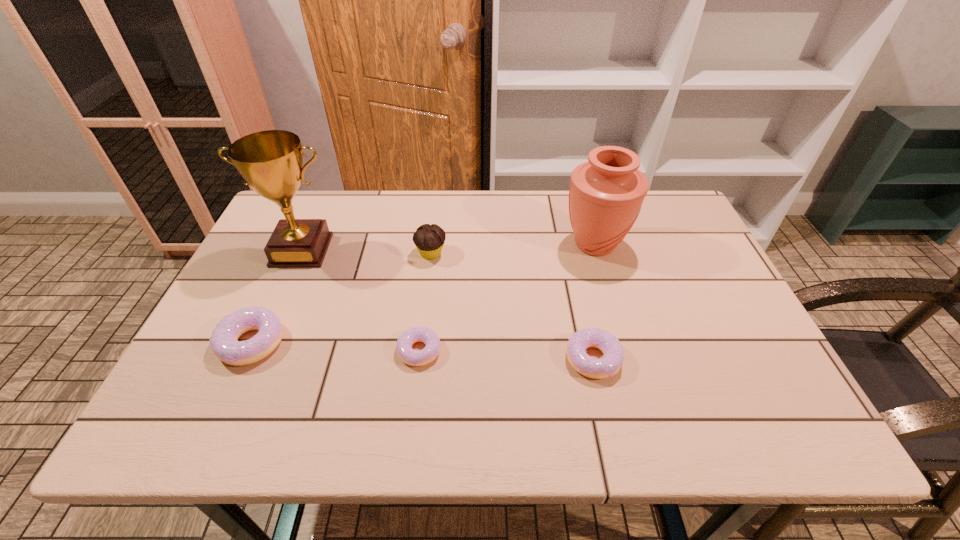
Where is `the third shortest object`? The image size is (960, 540). the third shortest object is located at coordinates coord(224,342).

The image size is (960, 540). Identify the location of the tallest doughnut. (224, 342).

In order to click on the second doughnut from left to right in this screenshot , I will do `click(406, 353)`.

I want to click on the shortest object, so click(x=406, y=353).

At what (x,y) coordinates should I click in order to perform the action: click on the rightmost doughnut. Please return your answer as a coordinate pair (x, y). The height and width of the screenshot is (540, 960). Looking at the image, I should click on (608, 365).

You are a GUI agent. You are given a task and a screenshot of the screen. Output one action in this format:
    pyautogui.click(x=<x>, y=<y>)
    Task: Click on the fifth tallest object
    
    Given the screenshot: What is the action you would take?
    pyautogui.click(x=608, y=365)

Locate an element on the screen. The image size is (960, 540). the second tallest object is located at coordinates (606, 193).

Locate an element on the screen. The image size is (960, 540). award is located at coordinates click(270, 161).

This screenshot has width=960, height=540. Find the location of `the fourth shortest object`. the fourth shortest object is located at coordinates (429, 239).

I want to click on vacant space positioned 0.240m on the back of the fourth tallest object, so click(x=293, y=253).